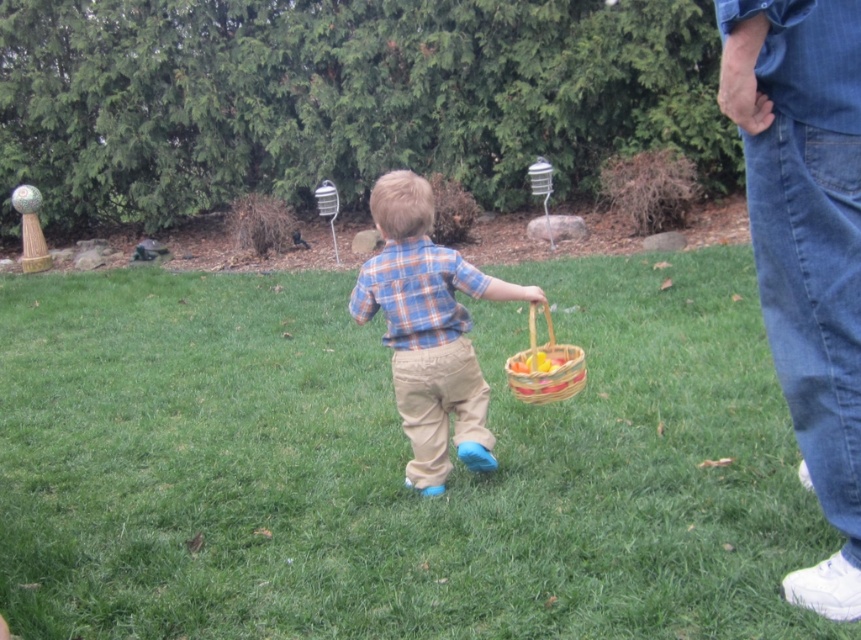
Question: Is denim jeans at right to the right of plaid shirt at center from the viewer's perspective?

Choices:
 (A) yes
 (B) no

Answer: (A)

Question: Which object appears closest to the camera in this image?

Choices:
 (A) woven wood basket at center
 (B) plaid shirt at center
 (C) denim jeans at right
 (D) green grass at center

Answer: (C)

Question: Is green grass at center below woven wood basket at center?

Choices:
 (A) no
 (B) yes

Answer: (B)

Question: Which object appears farthest from the camera in this image?

Choices:
 (A) green grass at center
 (B) denim jeans at right
 (C) woven wood basket at center
 (D) plaid shirt at center

Answer: (D)

Question: Can you confirm if plaid shirt at center is bigger than woven wood basket at center?

Choices:
 (A) no
 (B) yes

Answer: (B)

Question: Which point is closer to the camera?

Choices:
 (A) green grass at center
 (B) denim jeans at right
 (C) woven wood basket at center

Answer: (B)